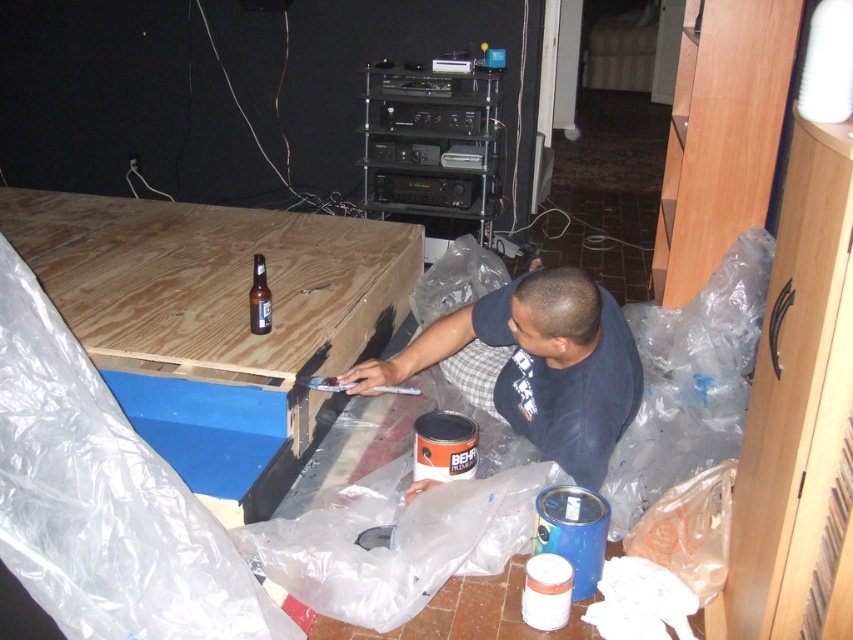
I want to click on dark blue shirt at center, so click(535, 365).

How distant is dark blue shirt at center from brown glass beer bottle at center?

A distance of 70.60 centimeters exists between dark blue shirt at center and brown glass beer bottle at center.

Between point (523, 317) and point (257, 328), which one is positioned behind?

Positioned behind is point (257, 328).

In order to click on dark blue shirt at center in this screenshot , I will do `click(535, 365)`.